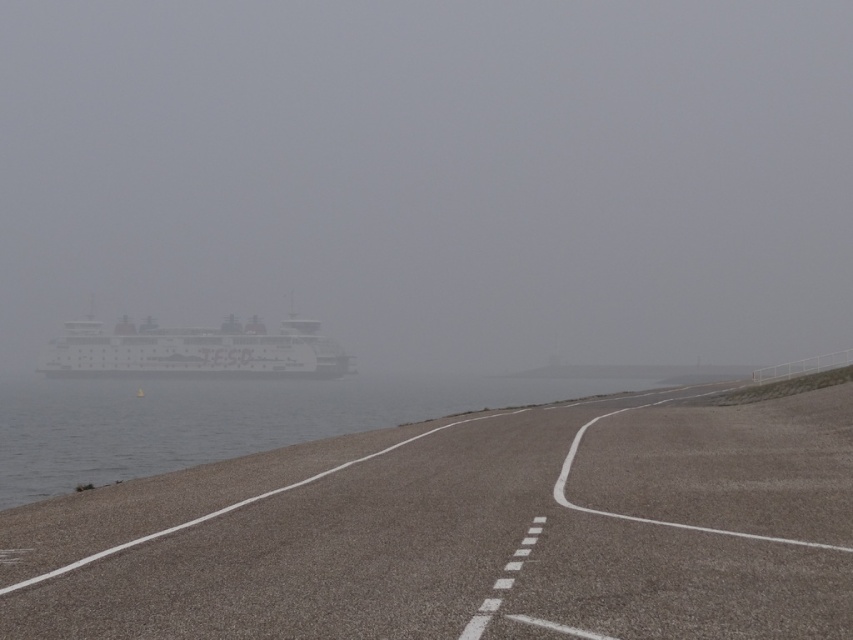
Question: Which object is farther from the camera taking this photo?

Choices:
 (A) gray asphalt shoreline at lower left
 (B) clear water at left
 (C) foggy white ship at center

Answer: (C)

Question: Is gray asphalt shoreline at lower left further to the viewer compared to clear water at left?

Choices:
 (A) yes
 (B) no

Answer: (B)

Question: Is gray asphalt shoreline at lower left to the left of clear water at left from the viewer's perspective?

Choices:
 (A) no
 (B) yes

Answer: (A)

Question: Which of the following is the farthest from the observer?

Choices:
 (A) (47, 464)
 (B) (555, 561)
 (C) (335, 244)
 (D) (251, 355)

Answer: (C)

Question: Among these objects, which one is farthest from the camera?

Choices:
 (A) gray asphalt shoreline at lower left
 (B) foggy white ship at center
 (C) white matte ship at left

Answer: (B)

Question: Where is foggy white ship at center located in relation to clear water at left in the image?

Choices:
 (A) above
 (B) below

Answer: (A)